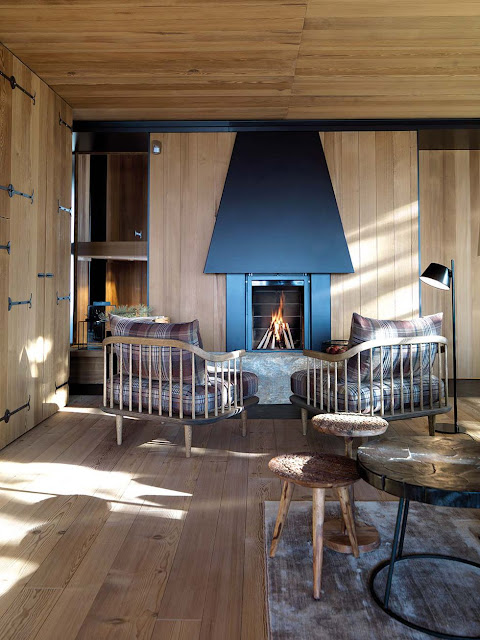
Identify the location of pillow on back of chair. Image resolution: width=480 pixels, height=640 pixels. (182, 332), (384, 326).